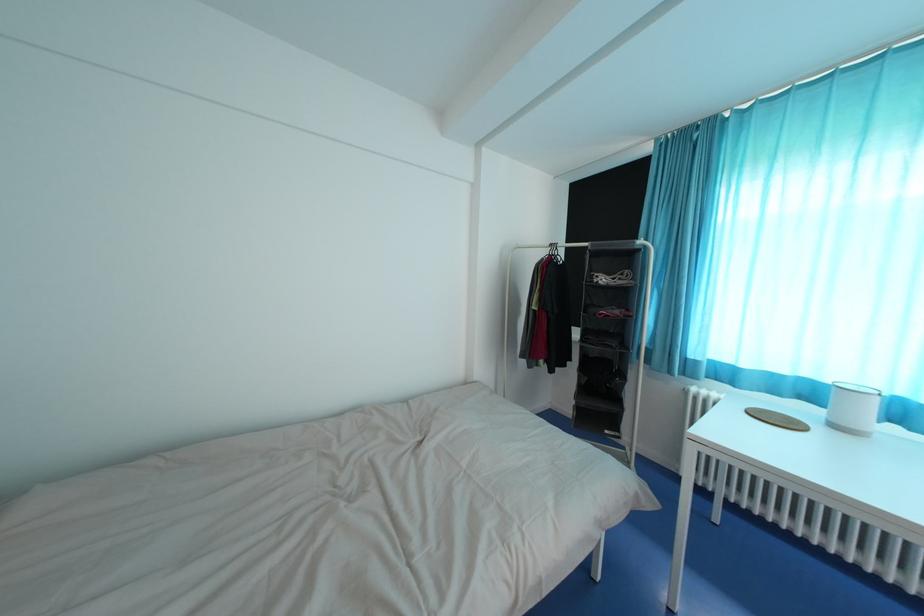
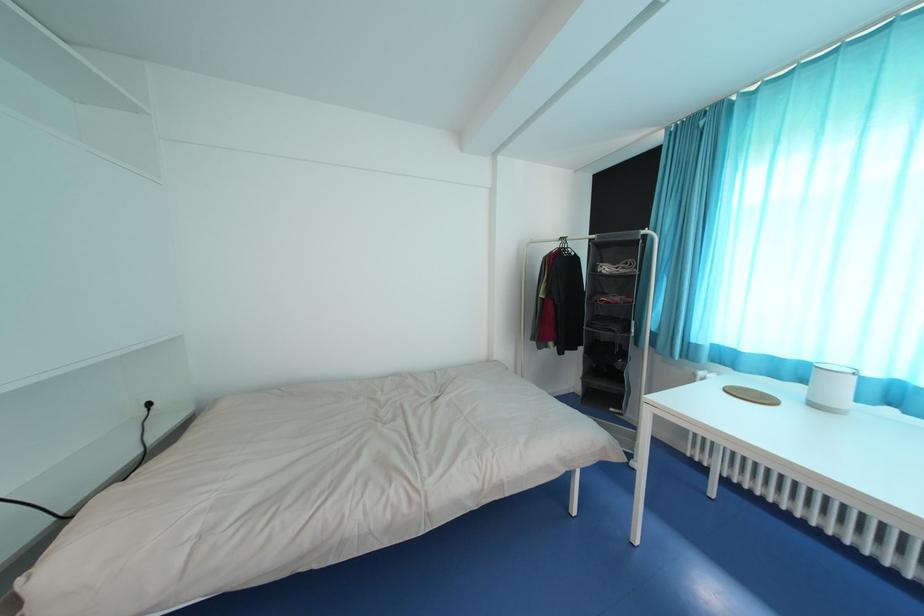
Question: Based on the continuous images, in which direction is the camera rotating? Reply with the corresponding letter.

Choices:
 (A) Left
 (B) Right
 (C) Up
 (D) Down

Answer: (A)